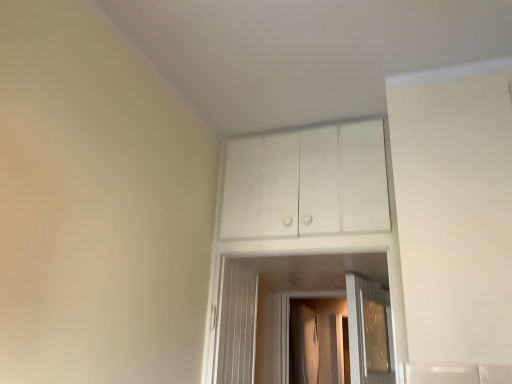
Question: Visually, is transparent plastic screen door at center positioned to the left or to the right of white matte cabinet at upper center?

Choices:
 (A) left
 (B) right

Answer: (B)

Question: In terms of height, does transparent plastic screen door at center look taller or shorter compared to white matte cabinet at upper center?

Choices:
 (A) short
 (B) tall

Answer: (B)

Question: Is transparent plastic screen door at center spatially inside white matte cabinet at upper center, or outside of it?

Choices:
 (A) inside
 (B) outside

Answer: (B)

Question: Is white matte cabinet at upper center taller or shorter than transparent plastic screen door at center?

Choices:
 (A) short
 (B) tall

Answer: (A)

Question: Is white matte cabinet at upper center bigger or smaller than transparent plastic screen door at center?

Choices:
 (A) big
 (B) small

Answer: (B)

Question: Would you say white matte cabinet at upper center is to the left or to the right of transparent plastic screen door at center in the picture?

Choices:
 (A) left
 (B) right

Answer: (A)

Question: Considering their positions, is white matte cabinet at upper center located in front of or behind transparent plastic screen door at center?

Choices:
 (A) front
 (B) behind

Answer: (A)